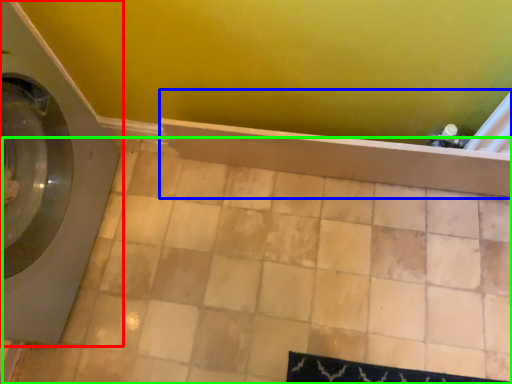
Question: Which object is the farthest from washing machine (highlighted by a red box)? Choose among these: bath (highlighted by a blue box) or ceramic tile (highlighted by a green box).

Choices:
 (A) bath
 (B) ceramic tile

Answer: (A)